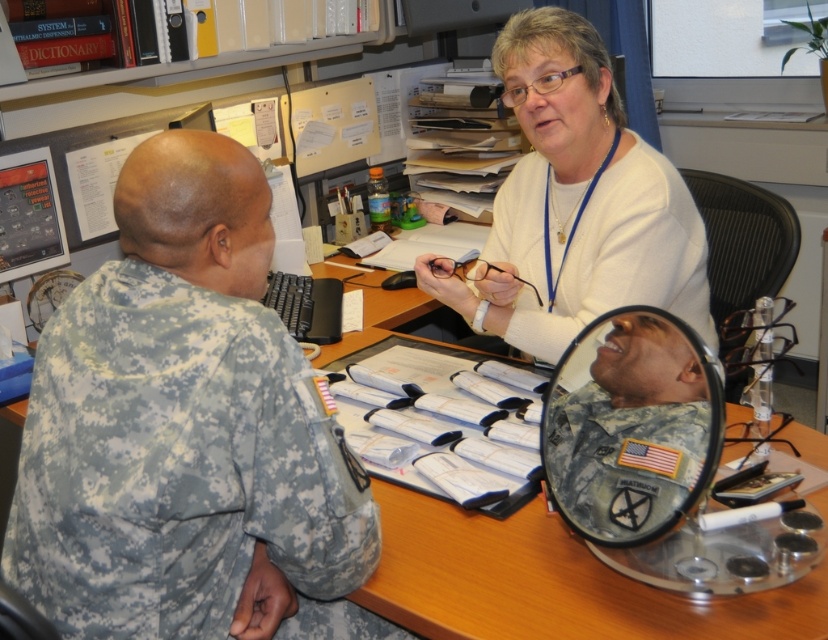
Between point (80, 300) and point (700, 301), which one is positioned in front?

Point (80, 300) is more forward.

Where is `camouflage uniform at left`? Image resolution: width=828 pixels, height=640 pixels. camouflage uniform at left is located at coordinates (186, 432).